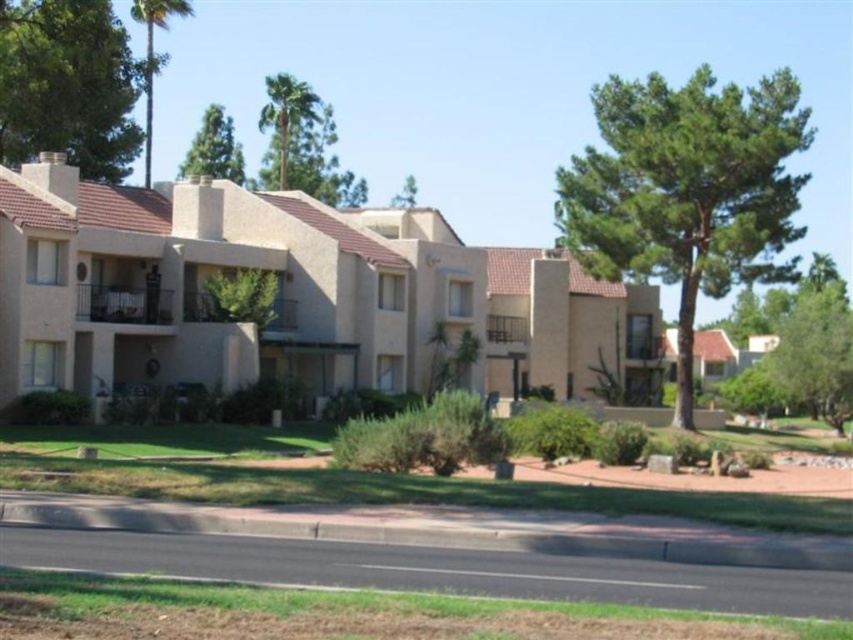
Which of these two, green leafy tree at upper right or green leafy tree at upper center, stands taller?

green leafy tree at upper right

Who is more forward, (737,90) or (193,140)?

Point (737,90) is more forward.

Does point (653, 156) come behind point (207, 116)?

No, it is in front of (207, 116).

You are a GUI agent. You are given a task and a screenshot of the screen. Output one action in this format:
    pyautogui.click(x=<x>, y=<y>)
    Task: Click on the green leafy tree at upper right
    The height and width of the screenshot is (640, 853).
    Given the screenshot: What is the action you would take?
    pyautogui.click(x=688, y=189)

Does green leafy palm tree at upper left have a smaller size compared to green leafy tree at center?

No, green leafy palm tree at upper left is not smaller than green leafy tree at center.

Is point (180, 8) farther from camera compared to point (410, 204)?

No, it is in front of (410, 204).

Measure the distance between point (190, 10) and camera.

Point (190, 10) and camera are 84.54 meters apart from each other.

This screenshot has height=640, width=853. Identify the location of green leafy palm tree at upper left. (154, 54).

Between green leafy tree at upper left and green leafy palm tree at upper left, which one has more height?

Standing taller between the two is green leafy palm tree at upper left.

Is point (28, 51) farther from viewer compared to point (148, 4)?

No, it is in front of (148, 4).

Where is `green leafy tree at upper left`? This screenshot has width=853, height=640. green leafy tree at upper left is located at coordinates (68, 84).

The height and width of the screenshot is (640, 853). What are the coordinates of `green leafy tree at upper left` in the screenshot? It's located at (68, 84).